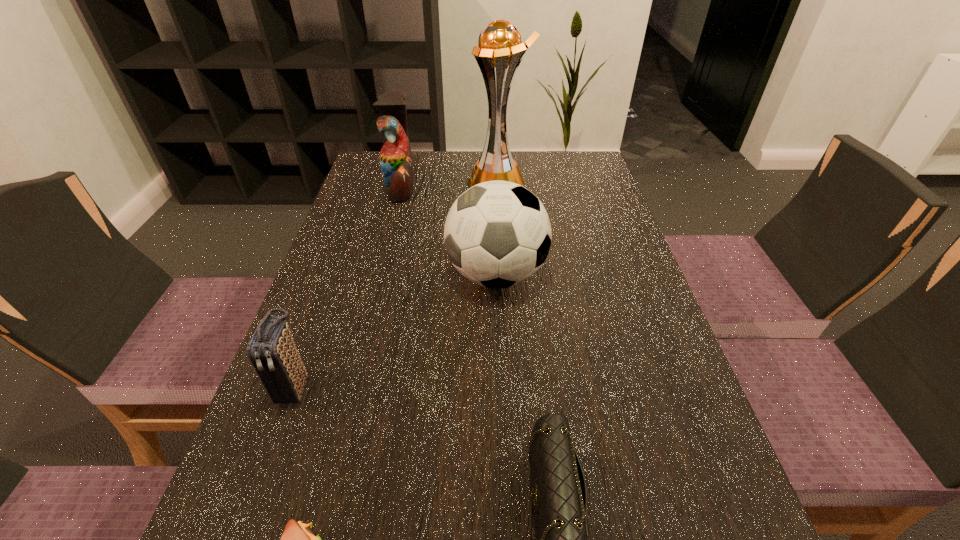
Where is `the tallest object`? the tallest object is located at coordinates (500, 45).

This screenshot has width=960, height=540. I want to click on parrot, so click(396, 164).

Where is `the third farthest object`? This screenshot has height=540, width=960. the third farthest object is located at coordinates (497, 234).

Where is `the fourth farthest object`? the fourth farthest object is located at coordinates (272, 351).

Locate an element on the screen. This screenshot has width=960, height=540. the taller clutch bag is located at coordinates (272, 351).

Locate an element on the screen. vacant space located 0.050m on the front-facing side of the tallest object is located at coordinates (451, 182).

Find the location of a particular element. The image size is (960, 540). free space located 0.220m on the front-facing side of the tallest object is located at coordinates click(x=394, y=182).

This screenshot has width=960, height=540. What are the coordinates of `vacant space located 0.250m on the front-facing side of the tallest object` in the screenshot? It's located at (383, 182).

What are the coordinates of `vacant space located at the face of the parrot` in the screenshot? It's located at (505, 187).

Find the location of a particular element. free space located 0.100m on the main logo of the soccer ball is located at coordinates (402, 275).